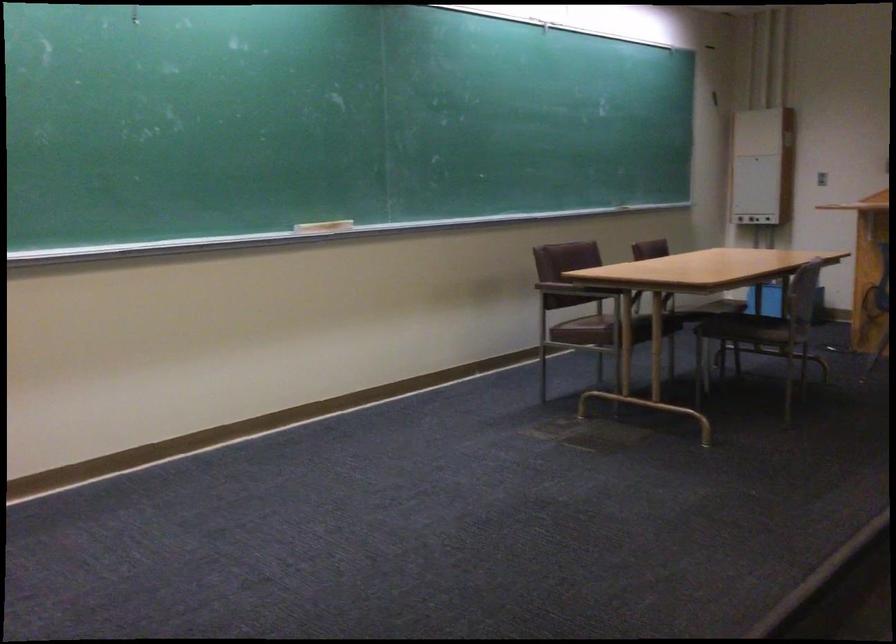
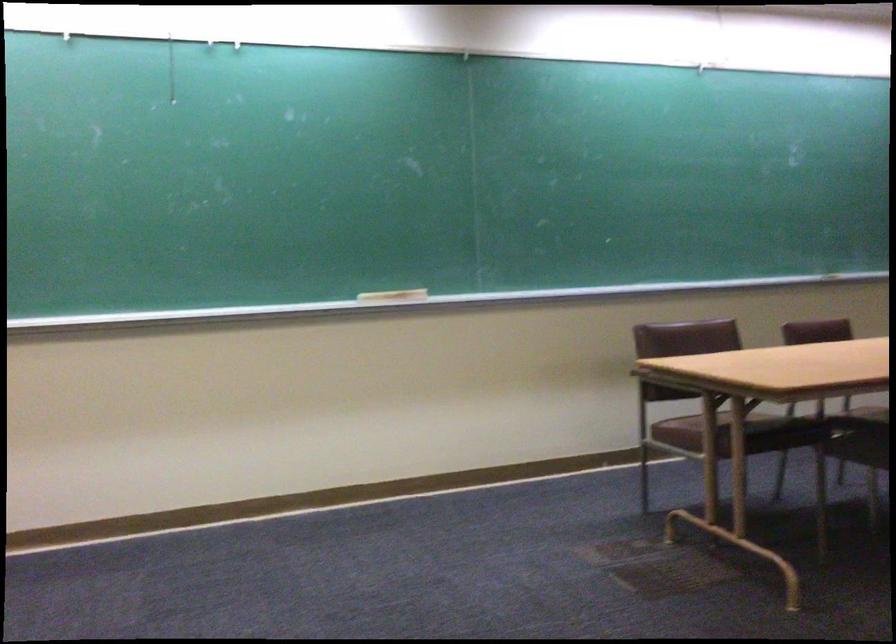
What movement of the cameraman would produce the second image?

The cameraman walked toward right, forward.